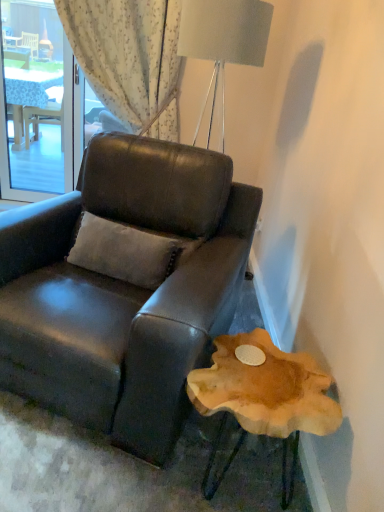
Question: Is suede-like beige pillow at center taller or shorter than transparent glass window at upper left?

Choices:
 (A) short
 (B) tall

Answer: (A)

Question: Considering the positions of point (137, 242) and point (3, 68), is point (137, 242) closer or farther from the camera than point (3, 68)?

Choices:
 (A) farther
 (B) closer

Answer: (B)

Question: Estimate the real-world distances between objects in this image. Which object is farther from the transparent glass window at upper left?

Choices:
 (A) suede-like beige pillow at center
 (B) matte black leather chair at center
 (C) natural wood side table at lower right

Answer: (C)

Question: Considering the real-world distances, which object is closest to the transparent glass window at upper left?

Choices:
 (A) natural wood side table at lower right
 (B) suede-like beige pillow at center
 (C) matte black leather chair at center

Answer: (C)